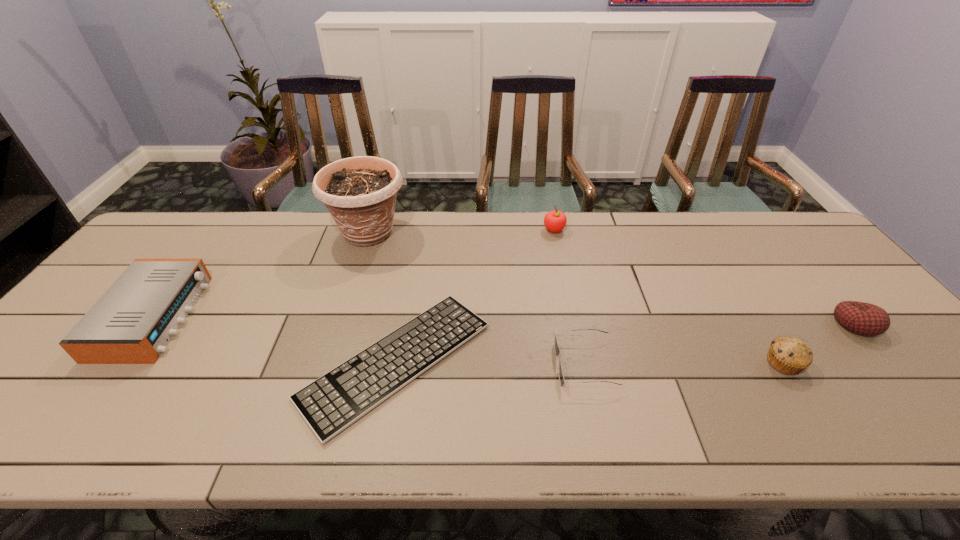
I want to click on the tallest object, so click(360, 192).

Identify the location of apple. The height and width of the screenshot is (540, 960). (554, 221).

At what (x,y) coordinates should I click in order to perform the action: click on the leftmost object. Please return your answer as a coordinate pair (x, y). Looking at the image, I should click on (134, 320).

Locate an element on the screen. Image resolution: width=960 pixels, height=540 pixels. the second object from right to left is located at coordinates (789, 355).

Where is `beanbag`? Image resolution: width=960 pixels, height=540 pixels. beanbag is located at coordinates (861, 318).

The image size is (960, 540). Find the location of `the sixth tallest object`. the sixth tallest object is located at coordinates (557, 350).

At what (x,y) coordinates should I click in order to perform the action: click on computer keyboard. Please return your answer as a coordinate pair (x, y). The image size is (960, 540). Looking at the image, I should click on (333, 402).

This screenshot has width=960, height=540. Identify the location of blank space located 0.400m on the left of the tallest object. (204, 233).

Where is `vacant space situated on the right of the apple`? The image size is (960, 540). vacant space situated on the right of the apple is located at coordinates (612, 230).

What are the coordinates of `vacant space situated 0.200m on the control panel of the leftmost object` in the screenshot? It's located at (269, 317).